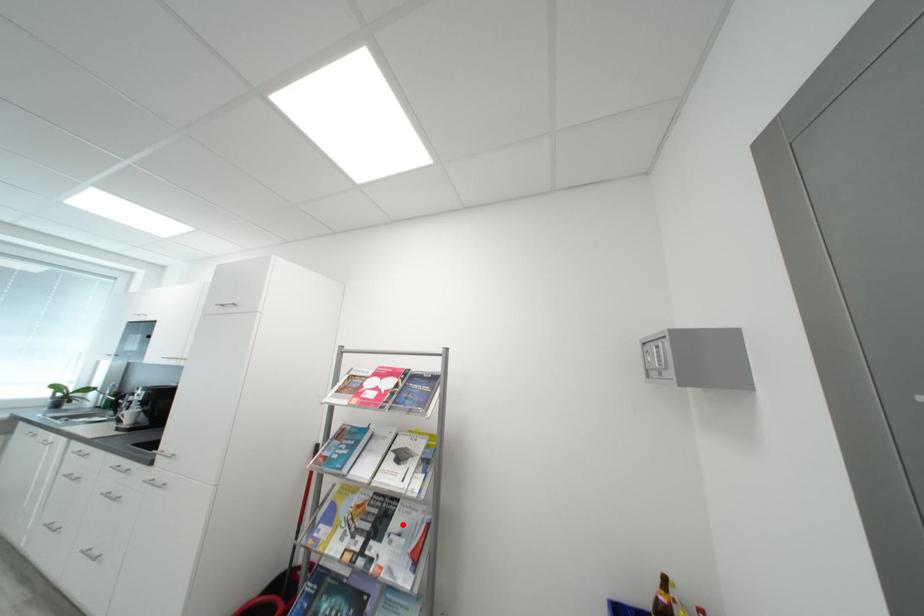
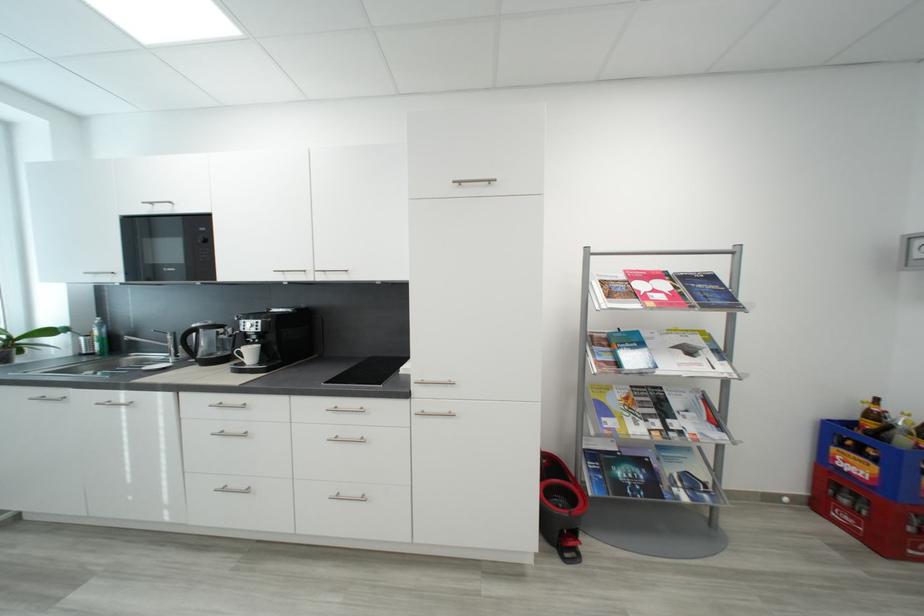
Question: A red point is marked in image1. In image2, is the corresponding 3D point closer to the camera or farther? Reply with the corresponding letter.

Choices:
 (A) The corresponding 3D point is closer.
 (B) The corresponding 3D point is farther.

Answer: (A)